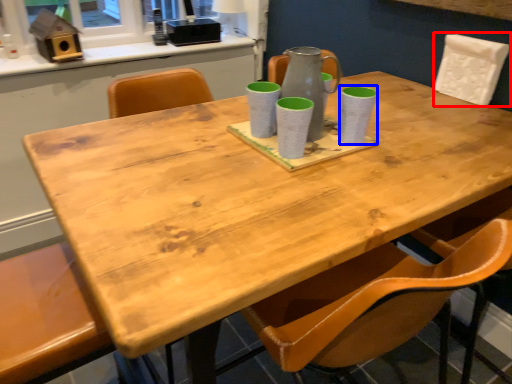
Question: Which object is closer to the camera taking this photo, chair (highlighted by a red box) or mug (highlighted by a blue box)?

Choices:
 (A) chair
 (B) mug

Answer: (B)